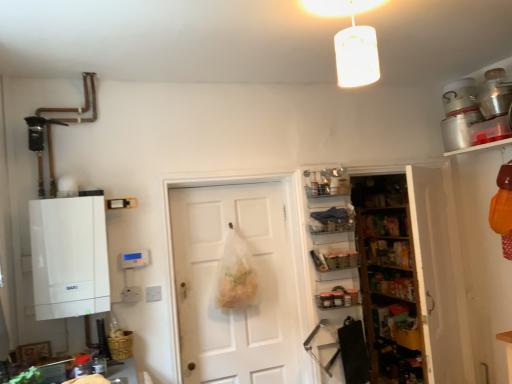
Question: Is bamboo basket at lower left oriented towards silver metallic canister at upper right, marked as the first appliance in a back-to-front arrangement?

Choices:
 (A) no
 (B) yes

Answer: (A)

Question: Considering the relative sizes of bamboo basket at lower left and silver metallic canister at upper right, the 2th appliance from the front, in the image provided, is bamboo basket at lower left taller than silver metallic canister at upper right, the 2th appliance from the front,?

Choices:
 (A) yes
 (B) no

Answer: (B)

Question: Is bamboo basket at lower left placed right next to silver metallic canister at upper right, marked as the first appliance in a back-to-front arrangement?

Choices:
 (A) no
 (B) yes

Answer: (A)

Question: From a real-world perspective, is bamboo basket at lower left positioned over silver metallic canister at upper right, marked as the first appliance in a back-to-front arrangement, based on gravity?

Choices:
 (A) no
 (B) yes

Answer: (A)

Question: From the image's perspective, is bamboo basket at lower left over silver metallic canister at upper right, marked as the first appliance in a back-to-front arrangement?

Choices:
 (A) yes
 (B) no

Answer: (B)

Question: Which is correct: metallic silver pot at upper right, the 1th appliance viewed from the front, is inside bamboo basket at lower left, or outside of it?

Choices:
 (A) outside
 (B) inside

Answer: (A)

Question: Considering the positions of metallic silver pot at upper right, acting as the 2th appliance starting from the back, and bamboo basket at lower left in the image, is metallic silver pot at upper right, acting as the 2th appliance starting from the back, taller or shorter than bamboo basket at lower left?

Choices:
 (A) tall
 (B) short

Answer: (A)

Question: Is metallic silver pot at upper right, acting as the 2th appliance starting from the back, bigger or smaller than bamboo basket at lower left?

Choices:
 (A) big
 (B) small

Answer: (A)

Question: From a real-world perspective, is metallic silver pot at upper right, the 1th appliance viewed from the front, physically located above or below bamboo basket at lower left?

Choices:
 (A) below
 (B) above

Answer: (B)

Question: From the image's perspective, is metallic silver spice rack at center-right, arranged as the third shelf when ordered from the bottom, located above or below metallic silver spice jars at center-right, placed as the fourth shelf when sorted from top to bottom?

Choices:
 (A) below
 (B) above

Answer: (B)

Question: Looking at their shapes, would you say metallic silver spice rack at center-right, which ranks as the 2th shelf in top-to-bottom order, is wider or thinner than metallic silver spice jars at center-right, placed as the fourth shelf when sorted from top to bottom?

Choices:
 (A) thin
 (B) wide

Answer: (B)

Question: From a real-world perspective, relative to metallic silver spice jars at center-right, placed as the fourth shelf when sorted from top to bottom, is metallic silver spice rack at center-right, arranged as the third shelf when ordered from the bottom, vertically above or below?

Choices:
 (A) above
 (B) below

Answer: (A)

Question: Considering the positions of metallic silver spice rack at center-right, which ranks as the 2th shelf in top-to-bottom order, and metallic silver spice jars at center-right, the 1th shelf in the bottom-to-top sequence, in the image, is metallic silver spice rack at center-right, which ranks as the 2th shelf in top-to-bottom order, bigger or smaller than metallic silver spice jars at center-right, the 1th shelf in the bottom-to-top sequence,?

Choices:
 (A) small
 (B) big

Answer: (A)

Question: From the image's perspective, is white matte boiler at left located above or below clear plastic shelves at center, the first shelf when ordered from top to bottom?

Choices:
 (A) below
 (B) above

Answer: (A)

Question: Looking at the image, does white matte boiler at left seem bigger or smaller compared to clear plastic shelves at center, the first shelf when ordered from top to bottom?

Choices:
 (A) big
 (B) small

Answer: (A)